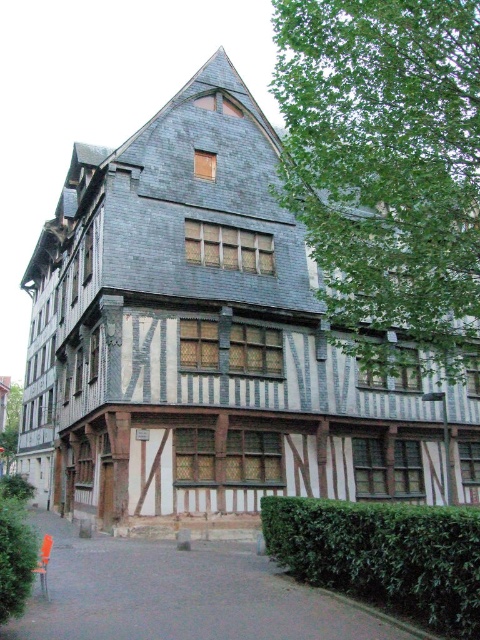
From the picture: Is green leafy hedge at lower right below green leafy hedge at lower left?

No, green leafy hedge at lower right is not below green leafy hedge at lower left.

Measure the distance from green leafy hedge at lower right to green leafy hedge at lower left.

They are 9.88 meters apart.

Does point (432, 589) come behind point (13, 544)?

That is True.

This screenshot has width=480, height=640. I want to click on green leafy hedge at lower right, so click(384, 556).